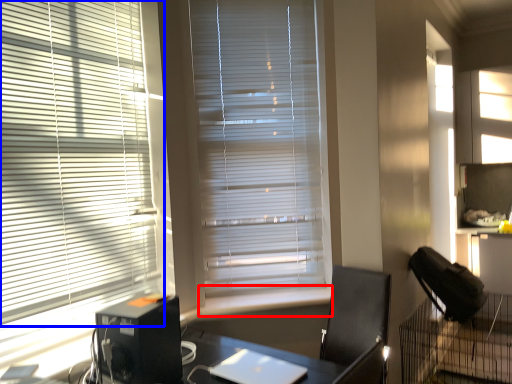
Question: Which object is closer to the camera taking this photo, window sill (highlighted by a red box) or window blind (highlighted by a blue box)?

Choices:
 (A) window sill
 (B) window blind

Answer: (B)